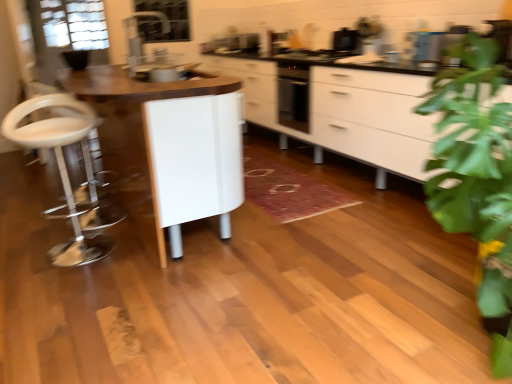
The width and height of the screenshot is (512, 384). Find the location of `vacant area that lies to the right of white glossy swivel chair at left`. vacant area that lies to the right of white glossy swivel chair at left is located at coordinates (134, 247).